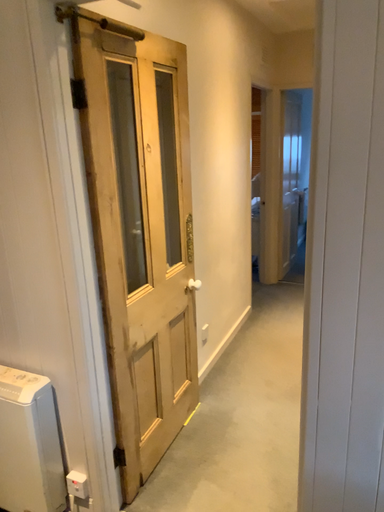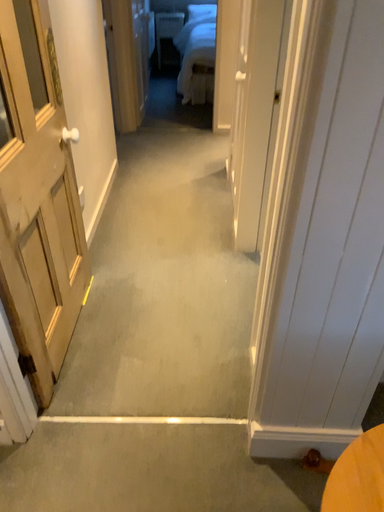
Question: Which way did the camera rotate in the video?

Choices:
 (A) rotated left
 (B) rotated right

Answer: (B)